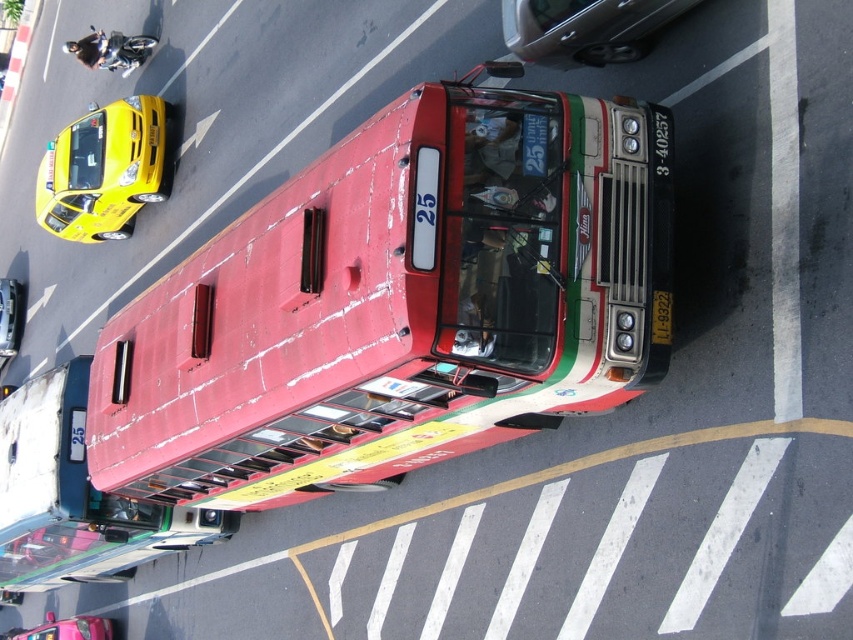
You are a delivery driver needing to park your 2.5 meter wide truck. You see a metallic silver sedan at upper center and a metallic silver car at left. Which parking spot can accommodate your truck if the spots are sized for standard cars?

The metallic silver sedan at upper center has a larger width than the metallic silver car at left, so the parking spot for the metallic silver sedan at upper center can accommodate your 2.5 meter wide truck since it requires a wider space.

You are standing on the bridge overlooking the busy street. You notice two points marked on the road below. The first point is at coordinates point [102,397] and the second is at point [521,13]. Which point is closer to you?

Point [102,397] is further to the camera than point [521,13], so the point closer to you is point [521,13].